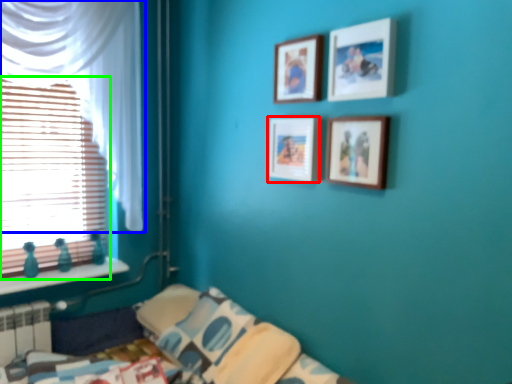
Question: Estimate the real-world distances between objects in this image. Which object is closer to picture frame (highlighted by a red box), curtain (highlighted by a blue box) or window (highlighted by a green box)?

Choices:
 (A) curtain
 (B) window

Answer: (A)